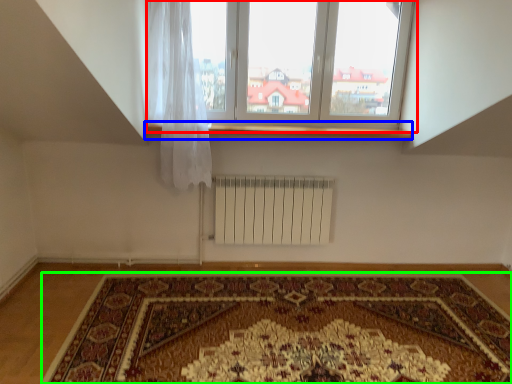
Question: Which is farther away from window (highlighted by a red box)? window sill (highlighted by a blue box) or mat (highlighted by a green box)?

Choices:
 (A) window sill
 (B) mat

Answer: (B)